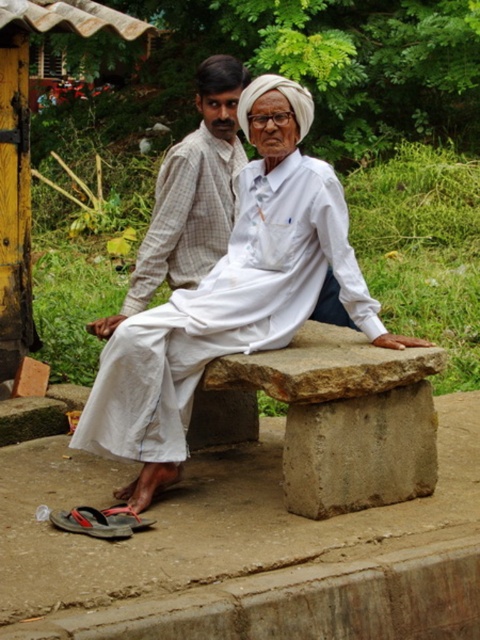
Looking at this image, you are a photographer trying to capture a closeup of both the white cotton cloth at center and the light brown checkered shirt at center in the scene. Given that your camera can only focus on objects within a 20 inch range, will you be able to capture both in focus?

The white cotton cloth at center and light brown checkered shirt at center are 23.51 inches apart from each other. Since the distance between them exceeds the camera focus range of 20 inches, you won

In the scene shown: You are a photographer trying to capture the two people on the stone bench. You want to ensure the white cotton cloth at center is in the exact center of your photo. Is the cloth already positioned correctly?

The white cotton cloth at center is already positioned at the exact center coordinates of the image, so it is perfectly centered.

You are standing at the point labeled as point (212,275) and want to take a photo of the two people on the stone bench. Since the point is 4.78 meters away from the camera, will you need to use a zoom lens to capture both individuals clearly in the frame?

The point labeled as point (212,275) is 4.78 meters away from the camera. To capture both individuals on the stone bench clearly, you would need to use a zoom lens to ensure they are in focus and properly framed at that distance.